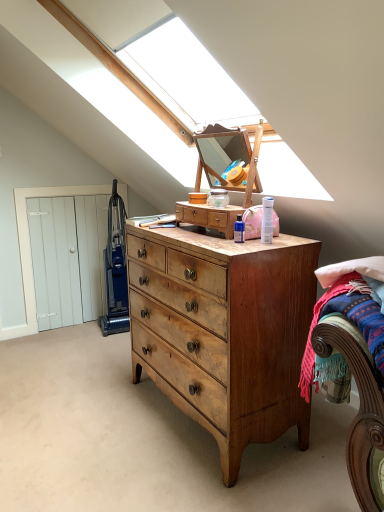
Find the location of a particular element. The height and width of the screenshot is (512, 384). free space in front of light brown wood dresser at center is located at coordinates (213, 239).